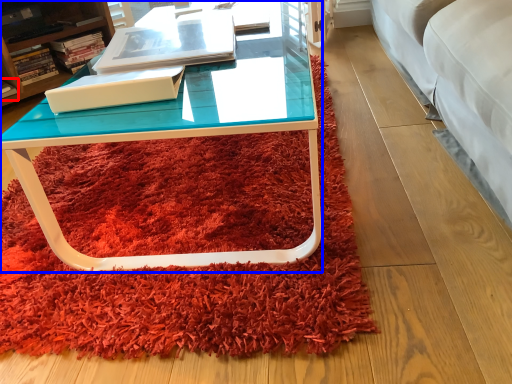
Question: Which object appears closest to the camera in this image, book (highlighted by a red box) or coffee table (highlighted by a blue box)?

Choices:
 (A) book
 (B) coffee table

Answer: (B)